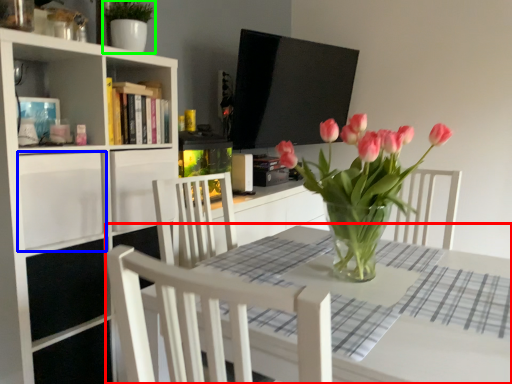
Question: Considering the real-world distances, which object is farthest from table (highlighted by a red box)? drawer (highlighted by a blue box) or plant (highlighted by a green box)?

Choices:
 (A) drawer
 (B) plant

Answer: (B)